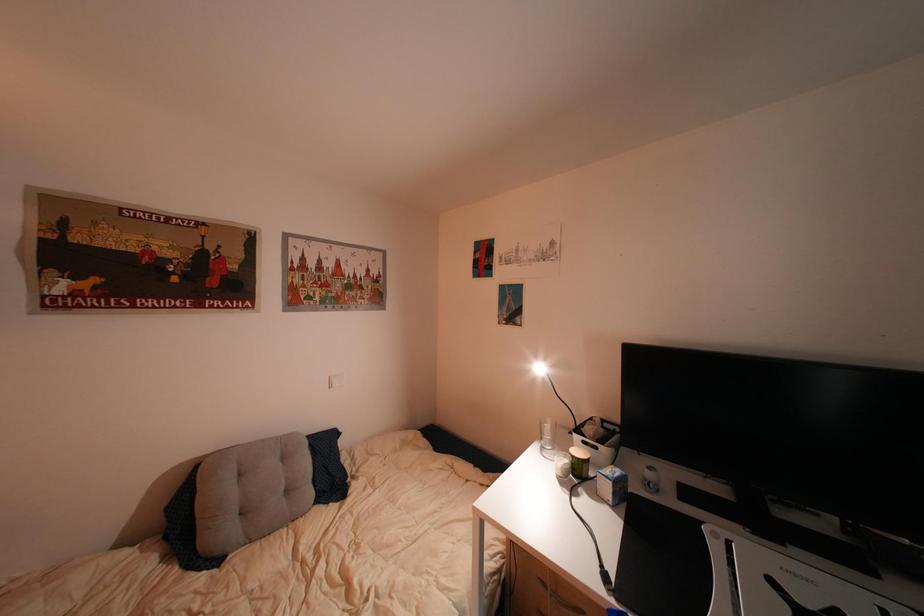
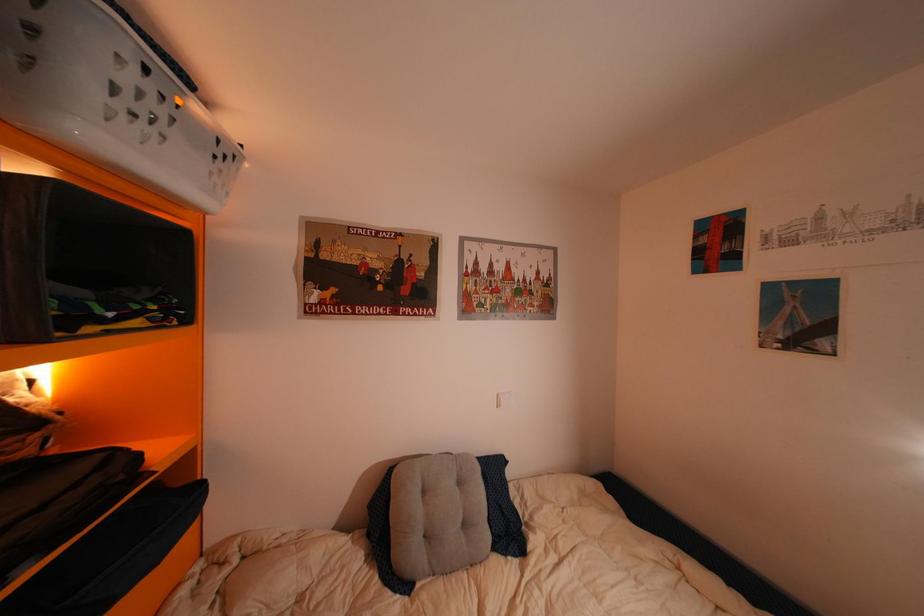
Question: The first image is from the beginning of the video and the second image is from the end. How did the camera likely rotate when shooting the video?

Choices:
 (A) Left
 (B) Right
 (C) Up
 (D) Down

Answer: (A)